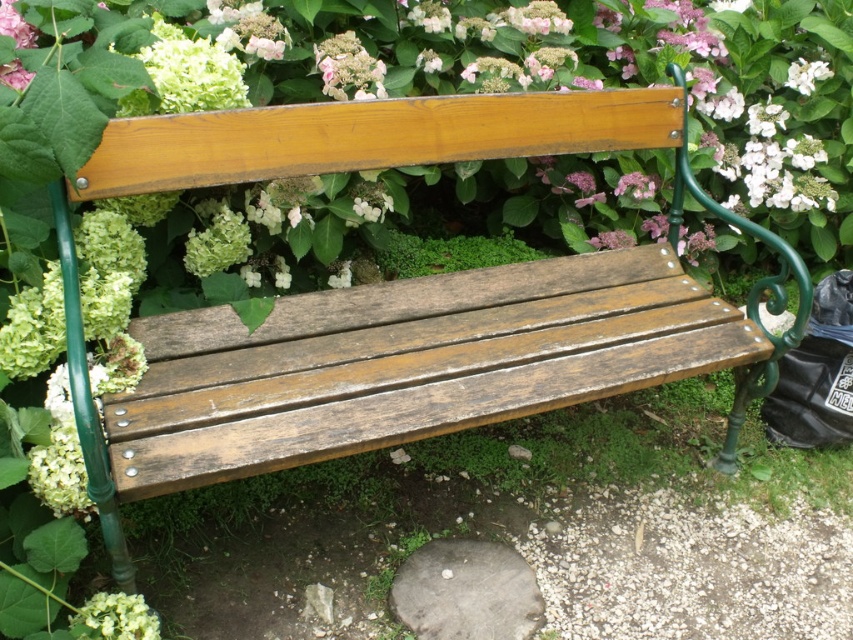
Question: Which object is the farthest from the pink matte flower at upper center?

Choices:
 (A) pink matte hydrangea at upper center
 (B) white fluffy flower at upper left
 (C) green mossy bush at center

Answer: (B)

Question: Which point appears closest to the camera in this image?

Choices:
 (A) (808, 76)
 (B) (157, 481)

Answer: (B)

Question: Does wooden bench at center appear on the right side of white fluffy flower at upper left?

Choices:
 (A) no
 (B) yes

Answer: (B)

Question: Among these objects, which one is farthest from the camera?

Choices:
 (A) white matte flower at upper center
 (B) white matte flower at lower left
 (C) green mossy bush at center
 (D) white fluffy flower at upper left

Answer: (A)

Question: Does white fluffy flower at upper left have a smaller size compared to white matte flower at upper center?

Choices:
 (A) no
 (B) yes

Answer: (A)

Question: Does green mossy bush at center have a lesser width compared to white matte flower at upper center?

Choices:
 (A) yes
 (B) no

Answer: (B)